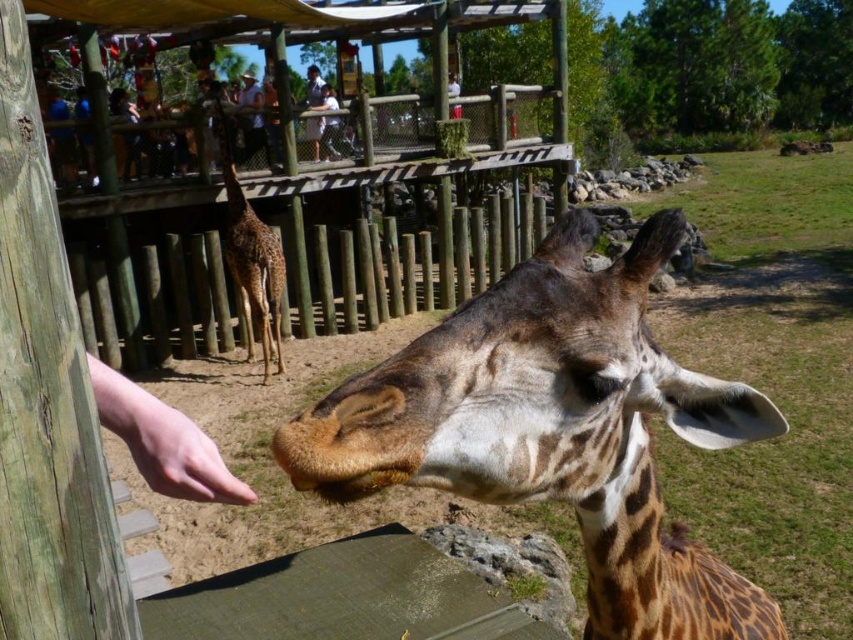
Which of these two, white shirt at upper center or white fabric shirt at upper center, stands taller?

Standing taller between the two is white shirt at upper center.

Can you confirm if white shirt at upper center is shorter than white fabric shirt at upper center?

Incorrect, white shirt at upper center's height does not fall short of white fabric shirt at upper center's.

Who is more forward, (318, 138) or (331, 141)?

Point (318, 138)

In order to click on white shirt at upper center in this screenshot , I will do point(314,88).

Between point (699, 426) and point (332, 147), which one is positioned behind?

The point (332, 147) is behind.

Does point (422, 384) come closer to viewer compared to point (329, 118)?

Yes, it is in front of point (329, 118).

Which is behind, point (476, 340) or point (329, 88)?

The point (329, 88) is behind.

Find the location of a particular element. This screenshot has width=853, height=640. spotted fur giraffe at center is located at coordinates (561, 426).

Does spotted fur giraffe at center lie in front of white shirt at upper center?

Yes, spotted fur giraffe at center is in front of white shirt at upper center.

In order to click on spotted fur giraffe at center in this screenshot , I will do `click(561, 426)`.